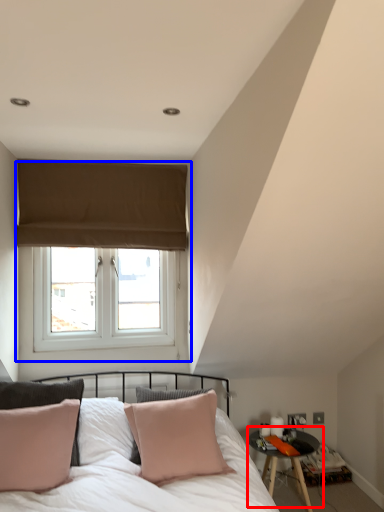
Question: Which object appears farthest to the camera in this image, table (highlighted by a red box) or window (highlighted by a blue box)?

Choices:
 (A) table
 (B) window

Answer: (B)